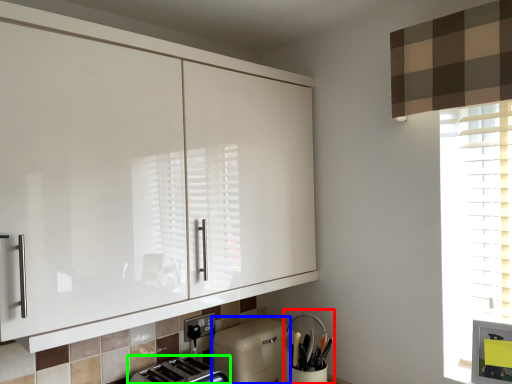
Question: Based on their relative distances, which object is nearer to appliance (highlighted by a red box)? Choose from dish washer (highlighted by a blue box) and toaster (highlighted by a green box).

Choices:
 (A) dish washer
 (B) toaster

Answer: (A)